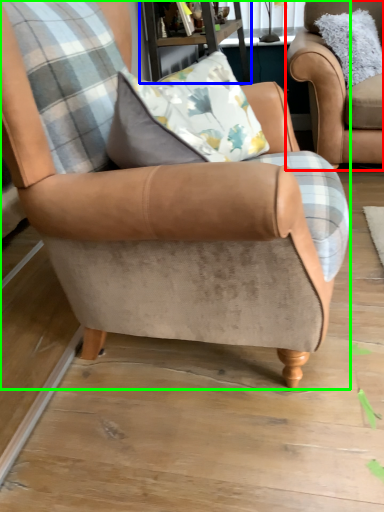
Question: Estimate the real-world distances between objects in this image. Which object is closer to chair (highlighted by a red box), table (highlighted by a blue box) or chair (highlighted by a green box)?

Choices:
 (A) table
 (B) chair

Answer: (A)